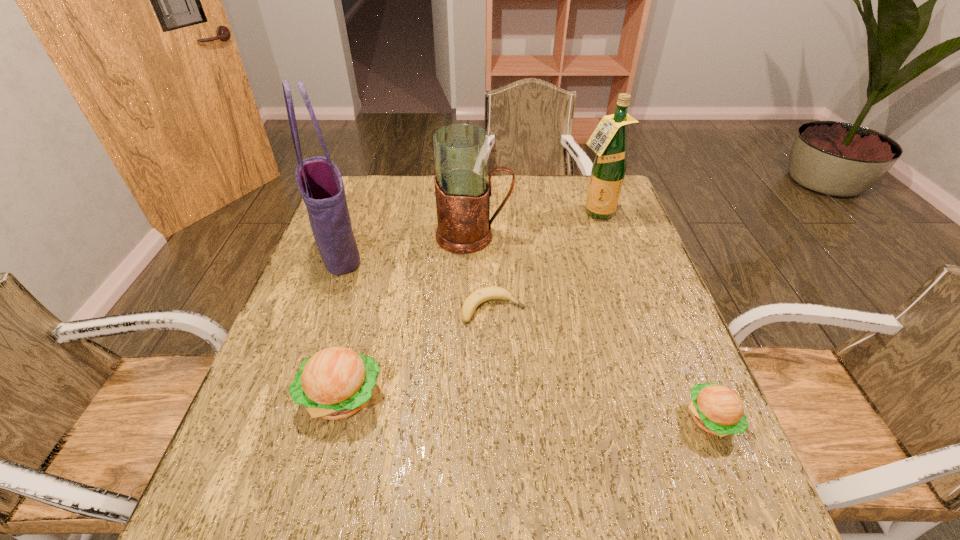
Where is `free space located on the back of the fifth tallest object`? Image resolution: width=960 pixels, height=540 pixels. free space located on the back of the fifth tallest object is located at coordinates (676, 334).

Locate an element on the screen. The width and height of the screenshot is (960, 540). vacant region located 0.150m on the back of the tote bag is located at coordinates tap(358, 202).

The width and height of the screenshot is (960, 540). I want to click on blank area located with the handle on the side of the fourth shortest object, so click(x=532, y=236).

The height and width of the screenshot is (540, 960). What are the coordinates of `free spot located 0.390m on the front-facing side of the liquor` in the screenshot? It's located at (632, 320).

I want to click on free region located on the back of the third nearest object, so click(491, 206).

This screenshot has width=960, height=540. What are the coordinates of `object at the far edge` in the screenshot? It's located at (608, 141).

The height and width of the screenshot is (540, 960). What are the coordinates of `hamburger positioned at the left edge` in the screenshot? It's located at pos(335,383).

Where is `tote bag located at the left edge`? The width and height of the screenshot is (960, 540). tote bag located at the left edge is located at coordinates (319, 181).

Locate an element on the screen. hamburger present at the right edge is located at coordinates (716, 409).

Find the location of a particular element. Image resolution: width=960 pixels, height=540 pixels. liquor at the right edge is located at coordinates (608, 141).